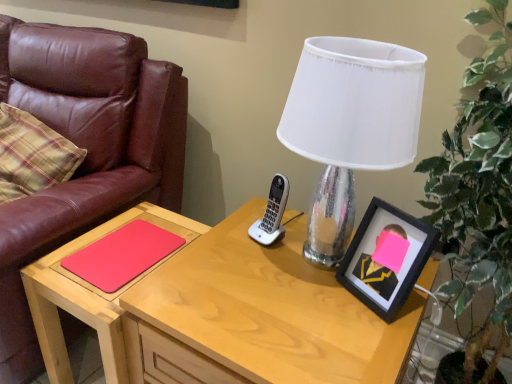
Locate an element on the screen. The image size is (512, 384). free point below clear glass lamp at center (from a real-world perspective) is located at coordinates (302, 256).